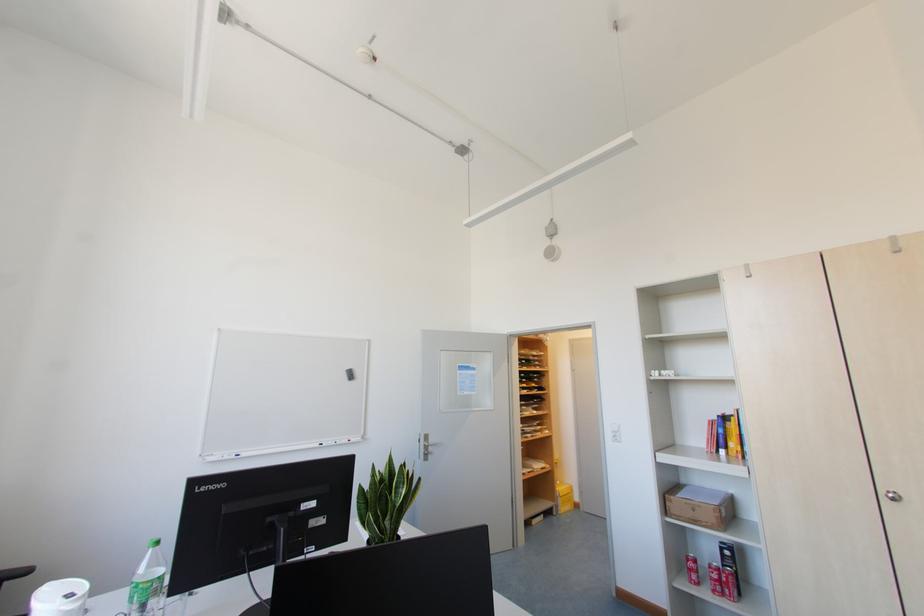
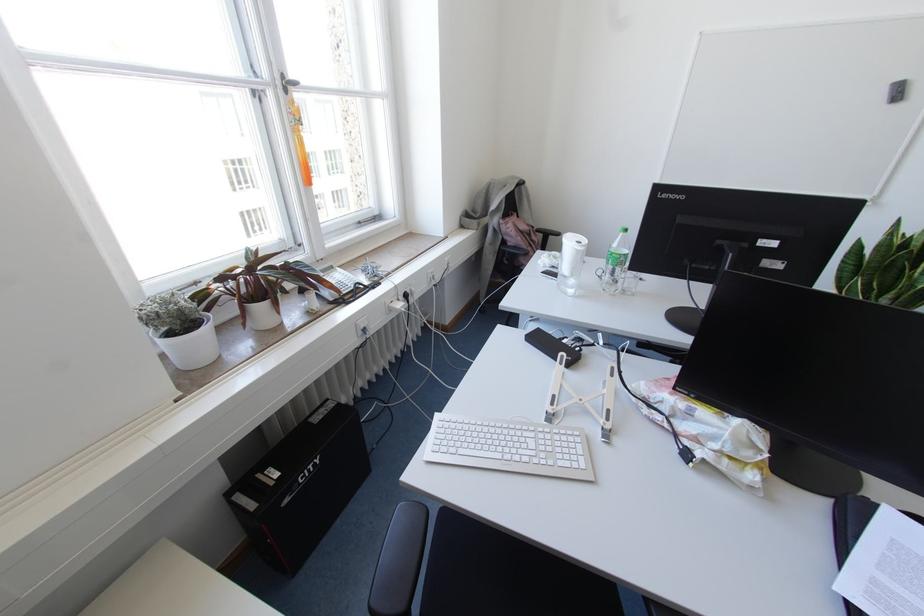
Where in the second image is the point corresponding to point (157, 541) from the first image?

(625, 229)